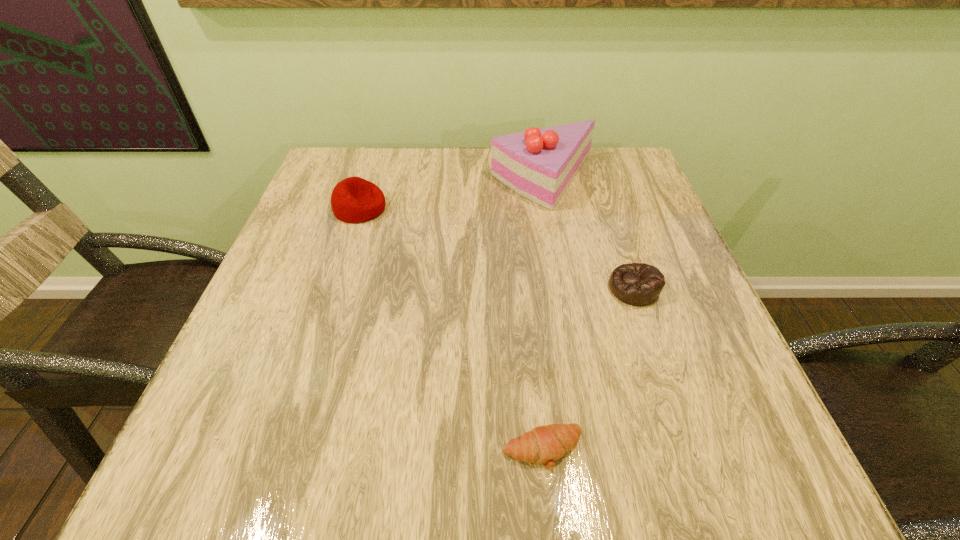
Where is `free spot located on the back of the shortest object`? This screenshot has width=960, height=540. free spot located on the back of the shortest object is located at coordinates [525, 280].

This screenshot has height=540, width=960. What are the coordinates of `cake located in the far edge section of the desktop` in the screenshot? It's located at pyautogui.click(x=539, y=164).

The image size is (960, 540). I want to click on beanbag that is at the far edge, so click(353, 200).

Locate an element on the screen. object present at the near edge is located at coordinates (545, 444).

Find the location of `object positioned at the left edge`. object positioned at the left edge is located at coordinates (353, 200).

At what (x,y) coordinates should I click in order to perform the action: click on cake at the right edge. Please return your answer as a coordinate pair (x, y). This screenshot has height=540, width=960. Looking at the image, I should click on (539, 164).

The height and width of the screenshot is (540, 960). I want to click on beanbag that is at the right edge, so click(638, 284).

Where is `object that is positioned at the far left corner`? The width and height of the screenshot is (960, 540). object that is positioned at the far left corner is located at coordinates (353, 200).

I want to click on object situated at the far right corner, so click(539, 164).

I want to click on blank space at the far edge of the desktop, so click(x=400, y=173).